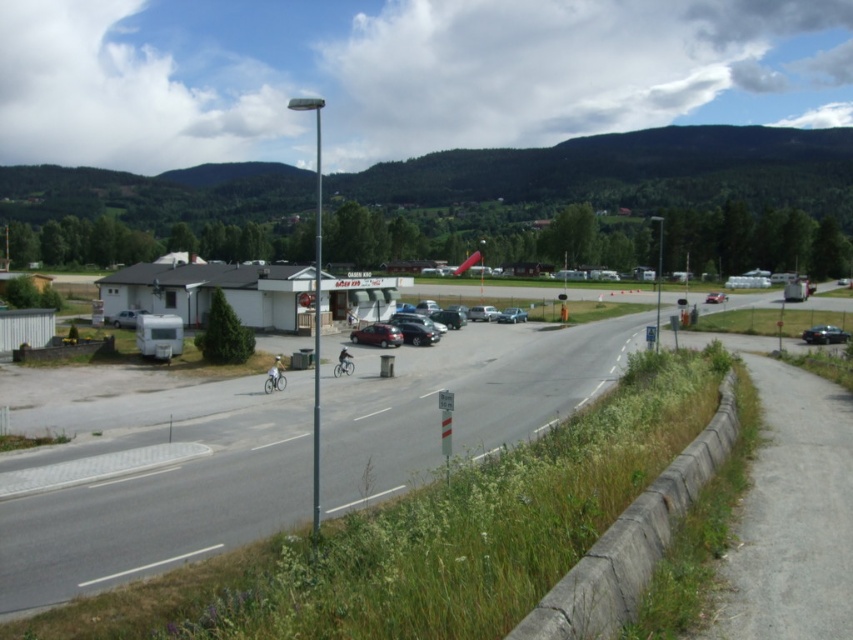
Question: Can you confirm if dark gray metallic motorcycle at center is positioned to the left of satin silver sedan at center?

Choices:
 (A) no
 (B) yes

Answer: (B)

Question: Which object appears farthest from the camera in this image?

Choices:
 (A) satin silver sedan at center
 (B) shiny metallic car at center
 (C) white matte bicycle at center
 (D) shiny black sedan at center

Answer: (A)

Question: Which object is closer to the camera taking this photo?

Choices:
 (A) metallic dark gray car at center-right
 (B) shiny black sedan at center
 (C) white matte bicycle at center
 (D) shiny metallic car at center

Answer: (C)

Question: Does shiny black sedan at center appear on the left side of satin silver sedan at center?

Choices:
 (A) yes
 (B) no

Answer: (A)

Question: Can you confirm if white matte bicycle at center is smaller than satin silver sedan at center?

Choices:
 (A) no
 (B) yes

Answer: (A)

Question: Among these points, which one is farthest from the camera?

Choices:
 (A) (421, 328)
 (B) (525, 314)
 (C) (276, 369)

Answer: (B)